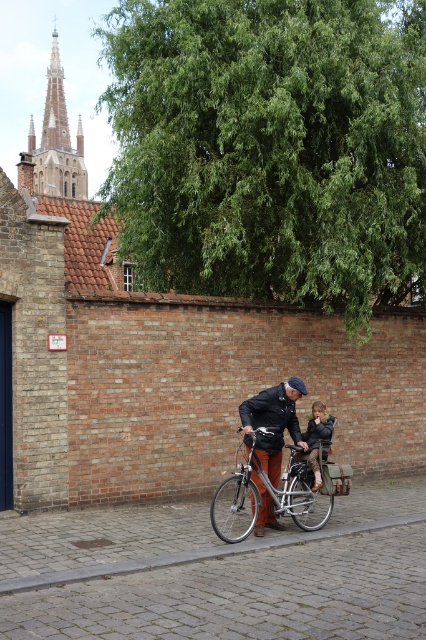
You are a delivery person who needs to carry a package that is 1 meter wide. You see the silver metallic bicycle at center and the brown leather jacket at center in the scene. Can you determine if the bicycle is wide enough to carry the package?

The silver metallic bicycle at center is wider than the brown leather jacket at center. Since the package is 1 meter wide, but we don not have the exact width of the jacket, we cannot determine if the bicycle can carry the package.